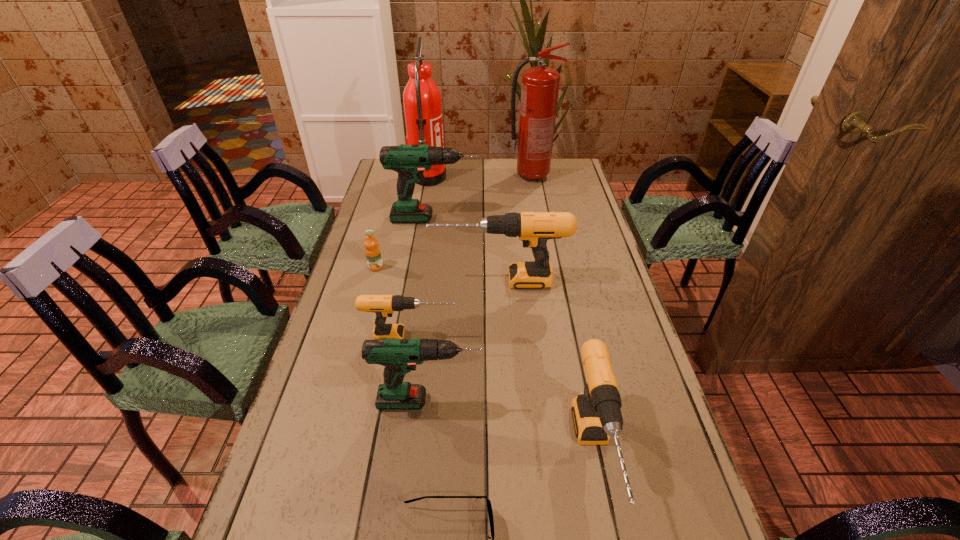
At what (x,y) coordinates should I click in order to perform the action: click on the left fire extinguisher. Please return your answer as a coordinate pair (x, y). Image resolution: width=960 pixels, height=540 pixels. Looking at the image, I should click on (422, 102).

This screenshot has width=960, height=540. Identify the location of red fire extinguisher. (540, 85).

This screenshot has width=960, height=540. I want to click on the bigger green drill, so click(x=410, y=161).

The height and width of the screenshot is (540, 960). In order to click on the farthest drill in this screenshot , I will do `click(410, 161)`.

The width and height of the screenshot is (960, 540). I want to click on the second farthest drill, so click(534, 229).

Find the location of `the farthest black drill`. the farthest black drill is located at coordinates (534, 229).

At what (x,y) coordinates should I click in order to perform the action: click on the nearer green drill. Please return your answer as a coordinate pair (x, y). The width and height of the screenshot is (960, 540). Looking at the image, I should click on (399, 356).

Image resolution: width=960 pixels, height=540 pixels. In order to click on the sixth farthest object in this screenshot , I will do `click(384, 306)`.

The width and height of the screenshot is (960, 540). What are the coordinates of `the third farthest drill` in the screenshot? It's located at (384, 306).

You are a GUI agent. You are given a task and a screenshot of the screen. Output one action in this format:
    pyautogui.click(x=<x>, y=<y>)
    Task: Click on the orange juice
    The width and height of the screenshot is (960, 540).
    Given the screenshot: What is the action you would take?
    pyautogui.click(x=372, y=250)